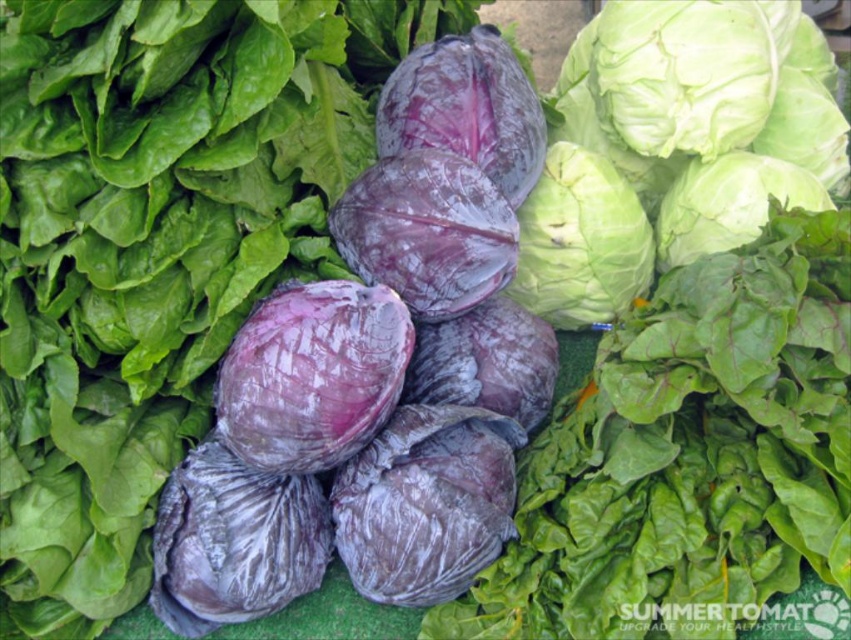
You are a grocery store employee who needs to place a 20 inch wide box between the purple matte cabbage at center and the green crisp at center. Can the box fit in the space between them?

The distance between the purple matte cabbage at center and the green crisp at center is 21.20 inches, so the 20 inch wide box can fit in the space between them since it is narrower than the available space.

Consider the image. You are a customer at the vegetable market looking for the green crisp at center. According to the scene, where would you find it relative to the purple matte cabbage at center?

The green crisp at center is to the right of the purple matte cabbage at center.

You are a vendor arranging vegetables. You have a purple matte cabbage at center and a green crisp at center. Which vegetable should you place on the shelf if the shelf space is limited to accommodate only the narrower one?

You should place the green crisp at center on the shelf since the purple matte cabbage at center might be wider than it and may not fit in the limited space.